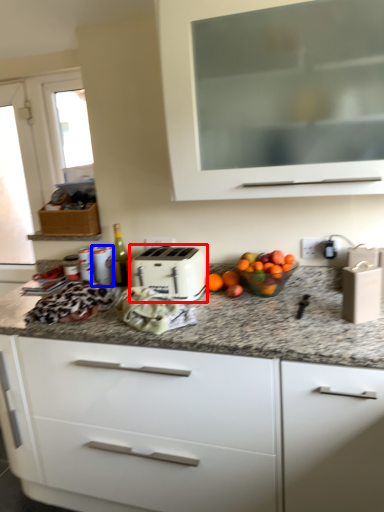
Question: Which point is further to the camera, toaster (highlighted by a red box) or appliance (highlighted by a blue box)?

Choices:
 (A) toaster
 (B) appliance

Answer: (B)